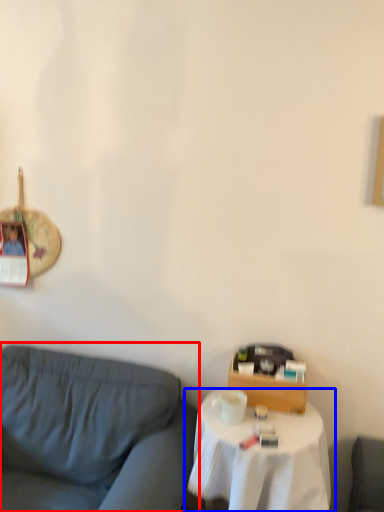
Question: Which object appears farthest to the camera in this image, studio couch (highlighted by a red box) or table (highlighted by a blue box)?

Choices:
 (A) studio couch
 (B) table

Answer: (B)